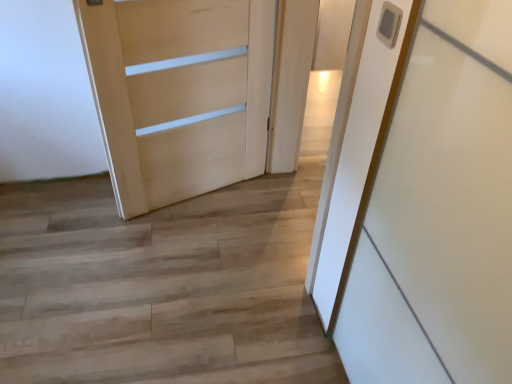
Question: Which direction should I rotate to look at white glossy door at center, the second door positioned from the left?

Choices:
 (A) left
 (B) right

Answer: (B)

Question: Is the surface of white glossy door at center, the 1th door positioned from the right, in direct contact with light wood door at center, which appears as the 2th door when viewed from the right?

Choices:
 (A) no
 (B) yes

Answer: (A)

Question: From a real-world perspective, is white glossy door at center, the 1th door positioned from the right, on top of light wood door at center, which is the first door in left-to-right order?

Choices:
 (A) no
 (B) yes

Answer: (A)

Question: Is white glossy door at center, the second door positioned from the left, facing away from light wood door at center, which appears as the 2th door when viewed from the right?

Choices:
 (A) no
 (B) yes

Answer: (A)

Question: Is white glossy door at center, the 1th door positioned from the right, at the right side of light wood door at center, which is the first door in left-to-right order?

Choices:
 (A) yes
 (B) no

Answer: (A)

Question: Can you confirm if white glossy door at center, the second door positioned from the left, is bigger than light wood door at center, which is the first door in left-to-right order?

Choices:
 (A) no
 (B) yes

Answer: (A)

Question: Is white glossy door at center, the second door positioned from the left, not close to light wood door at center, which is the first door in left-to-right order?

Choices:
 (A) yes
 (B) no

Answer: (B)

Question: Does wooden floor at center touch white glossy door at center, the second door positioned from the left?

Choices:
 (A) no
 (B) yes

Answer: (A)

Question: Is wooden floor at center at the right side of white glossy door at center, the second door positioned from the left?

Choices:
 (A) no
 (B) yes

Answer: (A)

Question: Is wooden floor at center closer to the viewer compared to white glossy door at center, the 1th door positioned from the right?

Choices:
 (A) yes
 (B) no

Answer: (A)

Question: Is white glossy door at center, the second door positioned from the left, located within wooden floor at center?

Choices:
 (A) no
 (B) yes

Answer: (A)

Question: Does wooden floor at center have a greater width compared to white glossy door at center, the second door positioned from the left?

Choices:
 (A) no
 (B) yes

Answer: (B)

Question: Is wooden floor at center aimed at white glossy door at center, the 1th door positioned from the right?

Choices:
 (A) no
 (B) yes

Answer: (A)

Question: Can we say white glossy door at center, the second door positioned from the left, lies outside wooden floor at center?

Choices:
 (A) yes
 (B) no

Answer: (A)